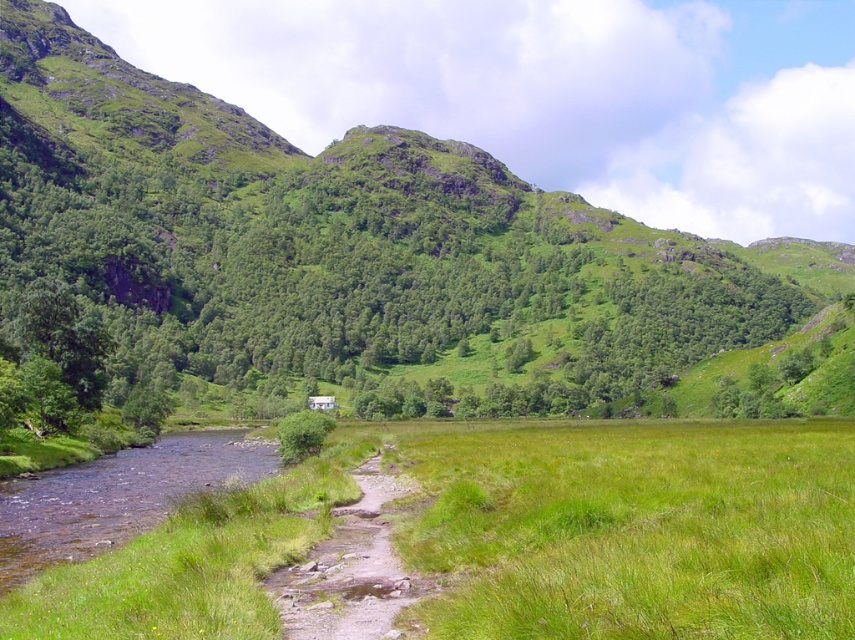
You are planning to cross the clear water at bottom left and the dirt path at lower center. Which one has a larger area to walk on?

The clear water at bottom left is bigger than dirt path at lower center, so the clear water at bottom left has a larger area to walk on.

You are planning a hiking route and see the green grassy hillside at center and the dirt path at lower center. Which one is closer to your current position if you are standing at the very front of the image?

The dirt path at lower center is closer to your current position because it is behind the green grassy hillside at center, meaning the hillside is between you and the path.